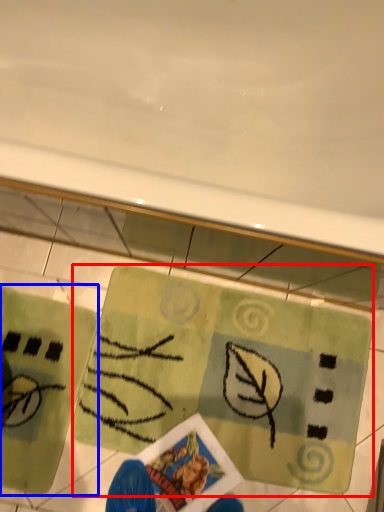
Question: Which point is closer to the camera, yoga mat (highlighted by a red box) or yoga mat (highlighted by a blue box)?

Choices:
 (A) yoga mat
 (B) yoga mat

Answer: (B)